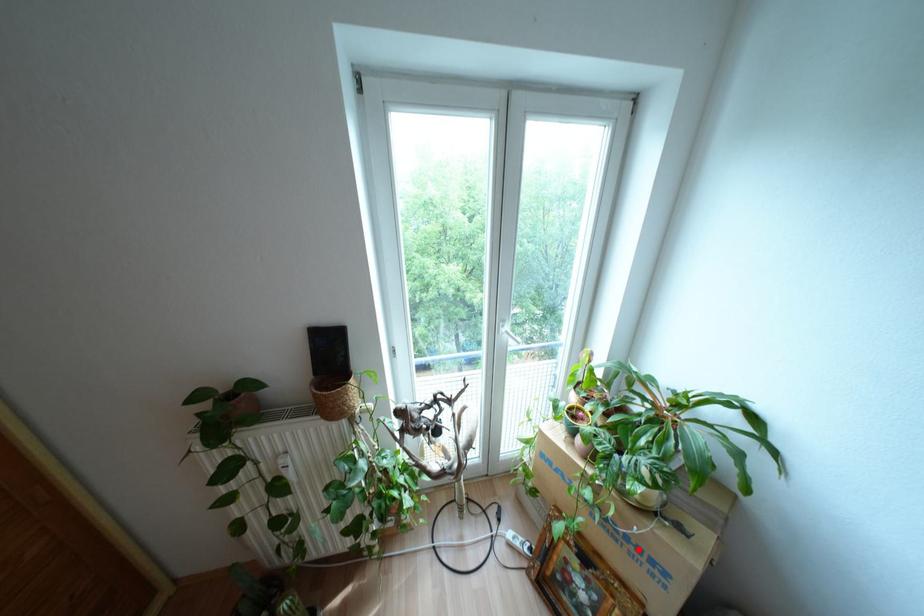
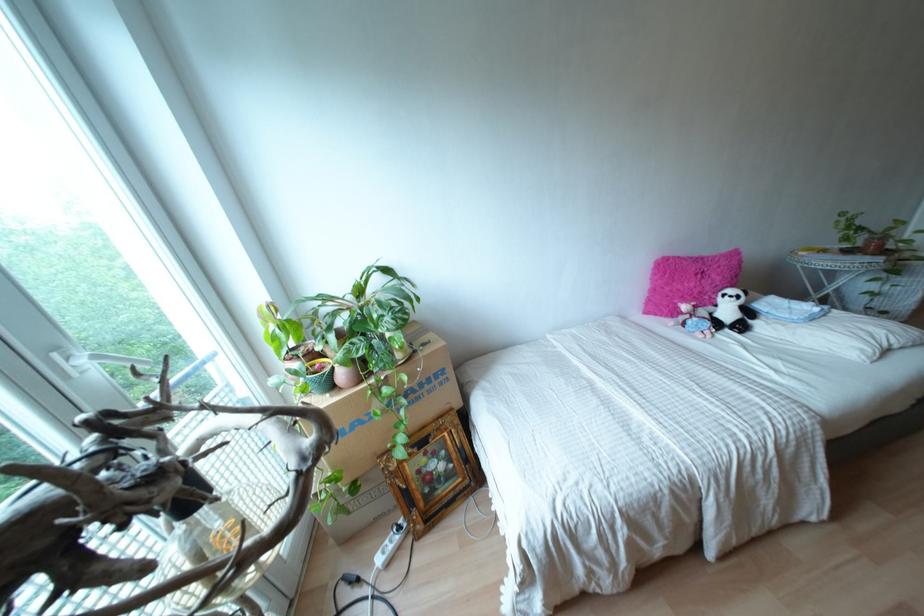
Find the pixel in the second image that matches the highlighted location in the first image.

(428, 379)